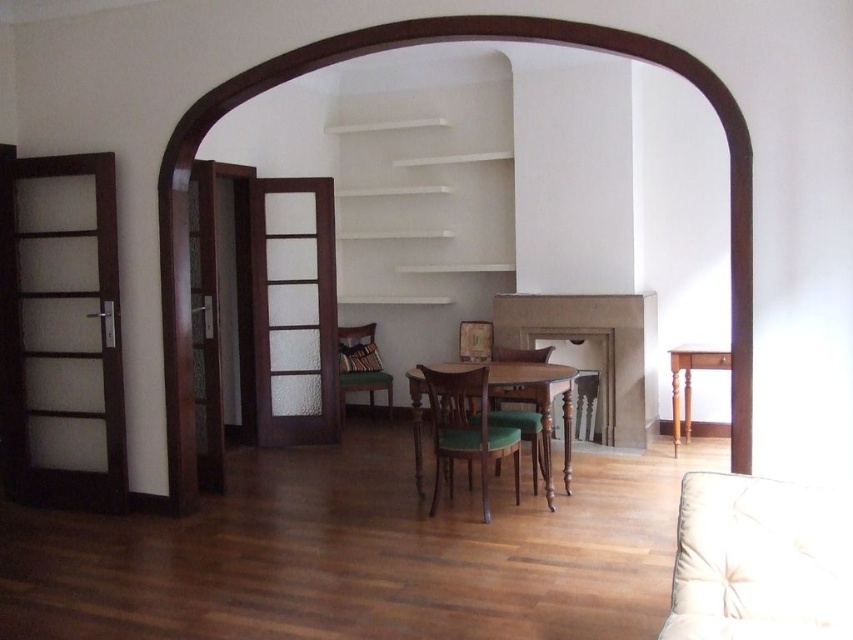
You are standing in the room and want to place a 4 meter long sofa in the space. Can you fit the sofa between the arched doorway and the wooden table at center?

The wooden table at center is 3.99 meters from the viewer. Since the sofa is 4 meters long, it would not fit as there is insufficient space between the arched doorway and the wooden table at center.

You are planning to place a large potted plant between the beige fabric armchair at lower right and the green fabric armchair at center. Based on their widths, which armchair should the plant be closer to?

The beige fabric armchair at lower right has a greater width than the green fabric armchair at center, so the plant should be placed closer to the beige fabric armchair at lower right to maintain balance.

You are standing in the room and want to move from the dark brown door with glass panels to the point that is closer to the camera. Which point should you head towards, point (x=544, y=429) or point (x=521, y=349)?

You should head towards point (x=544, y=429) because it is closer to the camera than point (x=521, y=349).